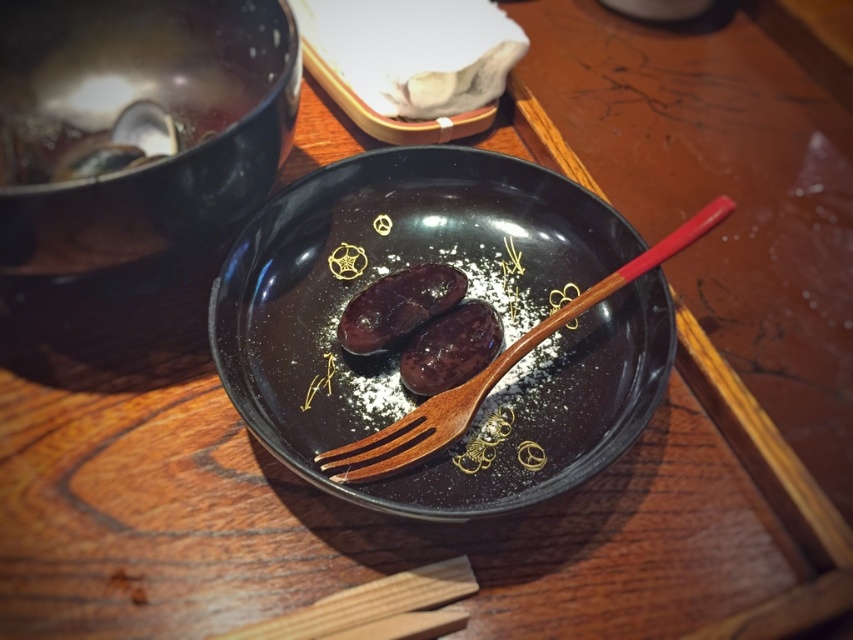
You are a server in a restaurant and need to place a new dish on the table. You have to decide whether to put it in front of the black matte plate at center or the glossy ceramic bowl at upper center. Which one is closer to you so you can place the dish there?

The black matte plate at center is closer to you than the glossy ceramic bowl at upper center, so you should place the dish in front of the black matte plate at center.

Looking at this image, you are a chef preparing a dish and need to place both the glossy ceramic bowl at upper center and the shiny dark brown meat at center on a shelf. The shelf has a height limit of 10 cm. Can both items fit vertically on the shelf without exceeding the height limit?

The glossy ceramic bowl at upper center is taller than the shiny dark brown meat at center. Since the shelf has a height limit of 10 cm, we need to check both items. However, the exact heights aren

You have a small cookie that needs to be placed on either the black matte plate at center or the glossy ceramic bowl at upper center. Based on their sizes, which one can fit the cookie more appropriately?

The black matte plate at center is wider than the glossy ceramic bowl at upper center, so the cookie would fit more appropriately on the black matte plate at center.